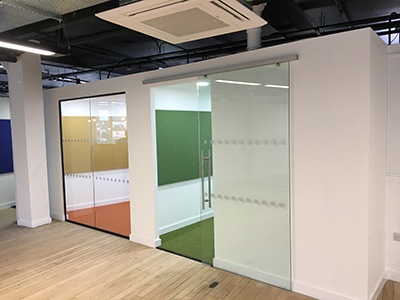
The image size is (400, 300). Identify the location of board. (173, 155).